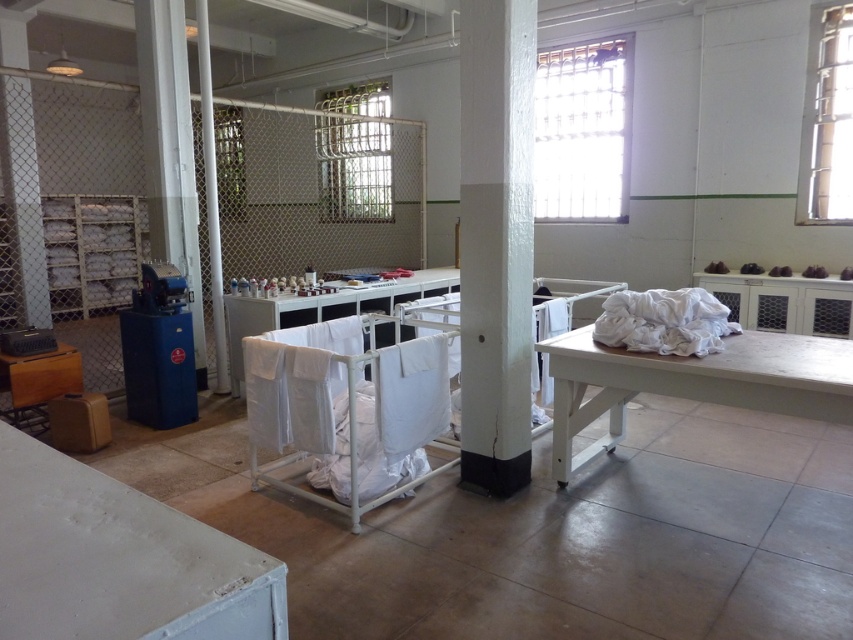
You are standing in the laundry room and need to place a new white fabric at center. According to the existing layout, where exactly should you position it?

The white fabric at center should be positioned at point coordinates of [664,321].